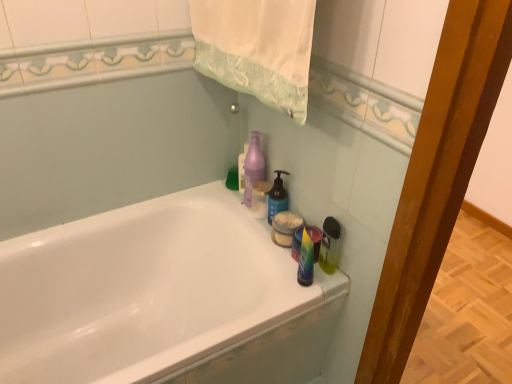
Question: From a real-world perspective, is purple matte pump bottle at upper center, which is counted as the second cleaning product, starting from the left, positioned above or below white glossy bathtub at upper center?

Choices:
 (A) below
 (B) above

Answer: (B)

Question: Is purple matte pump bottle at upper center, which is counted as the second cleaning product, starting from the left, taller or shorter than white glossy bathtub at upper center?

Choices:
 (A) tall
 (B) short

Answer: (B)

Question: Considering the real-world distances, which object is farthest from the white glossy bathtub at upper center?

Choices:
 (A) white fabric towel at upper center
 (B) purple matte bottle at upper center, which appears as the fourth cleaning product when viewed from the right
 (C) purple matte pump bottle at upper center, which is counted as the second cleaning product, starting from the left
 (D) translucent plastic spray bottle at right, the first cleaning product in the right-to-left sequence
 (E) blue matte bottle at upper right, arranged as the second cleaning product when viewed from the right

Answer: (A)

Question: Based on their relative distances, which object is nearer to the blue matte bottle at upper right, placed as the third cleaning product when sorted from left to right?

Choices:
 (A) purple matte pump bottle at upper center, which is counted as the second cleaning product, starting from the left
 (B) white glossy bathtub at upper center
 (C) translucent plastic spray bottle at right, arranged as the fourth cleaning product when viewed from the left
 (D) white fabric towel at upper center
 (E) purple matte bottle at upper center, positioned as the first cleaning product in left-to-right order

Answer: (A)